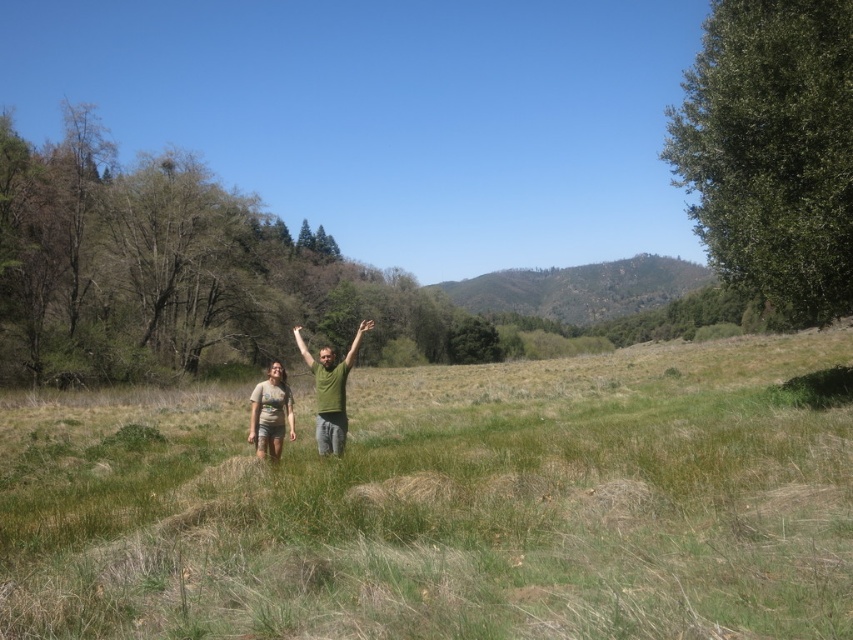
Question: From the image, what is the correct spatial relationship of green leafy tree at right in relation to green matte shirt at center?

Choices:
 (A) left
 (B) right

Answer: (B)

Question: Which point is closer to the camera?

Choices:
 (A) (338, 401)
 (B) (3, 621)

Answer: (B)

Question: Considering the relative positions of green textured hillside at center and green matte shirt at center in the image provided, where is green textured hillside at center located with respect to green matte shirt at center?

Choices:
 (A) above
 (B) below

Answer: (A)

Question: In this image, where is green matte shirt at center located relative to matte brown shorts at center?

Choices:
 (A) above
 (B) below

Answer: (A)

Question: Which point appears farthest from the camera in this image?

Choices:
 (A) (799, 202)
 (B) (250, 438)
 (C) (306, 355)
 (D) (602, 285)

Answer: (D)

Question: Which point is farther to the camera?

Choices:
 (A) (277, 445)
 (B) (492, 296)

Answer: (B)